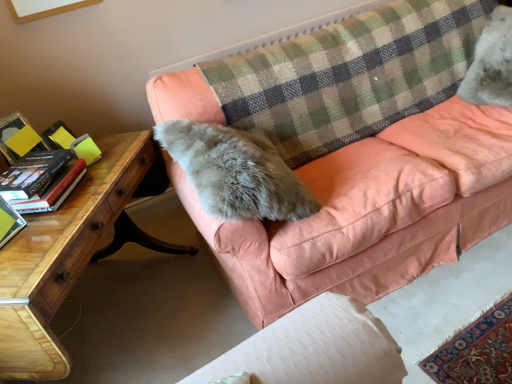
You are a GUI agent. You are given a task and a screenshot of the screen. Output one action in this format:
    pyautogui.click(x=<x>, y=<y>)
    Task: Click on the free spot in front of hardcover book at left, the first paperback book viewed from the back
    
    Given the screenshot: What is the action you would take?
    pyautogui.click(x=58, y=225)